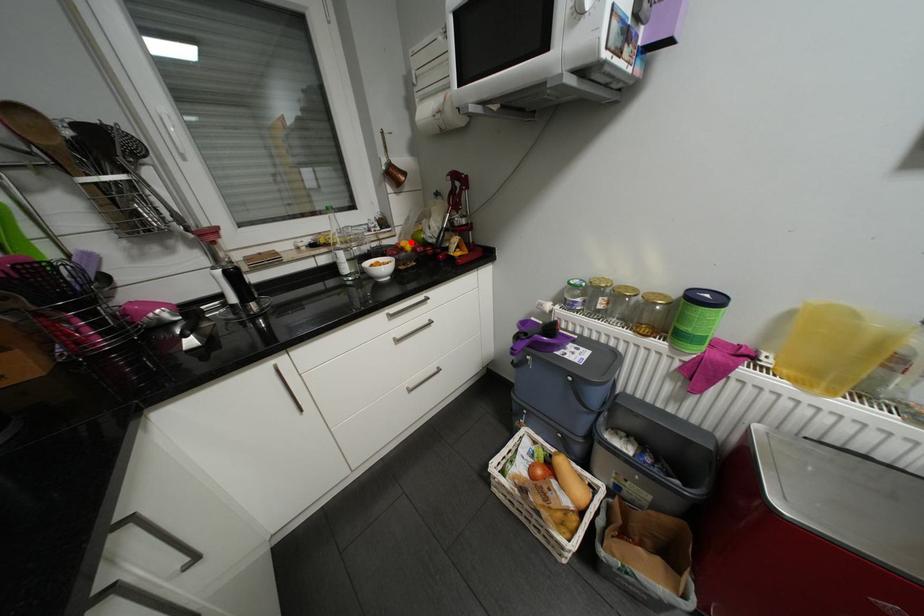
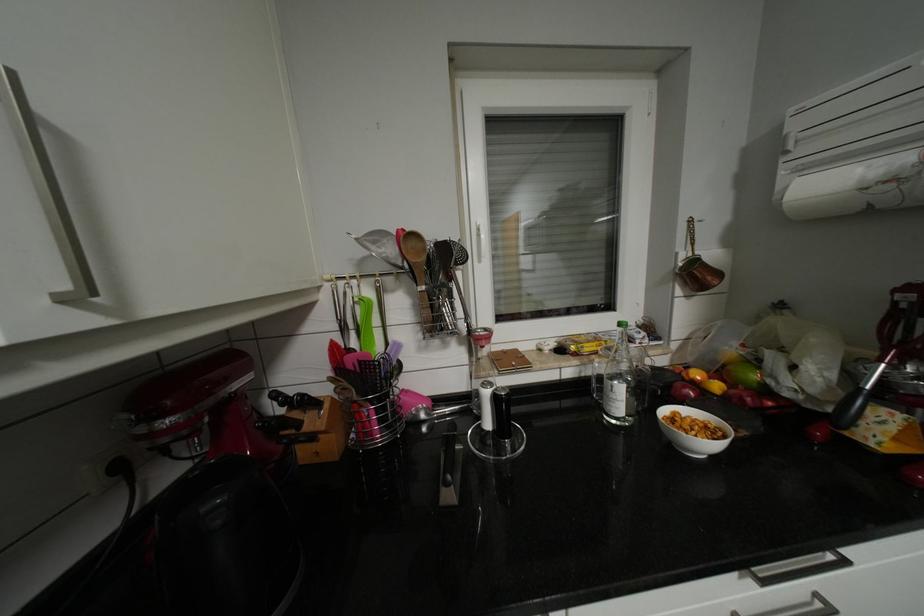
The point at the highlighted location is marked in the first image. Where is the corresponding point in the second image?

(704, 374)